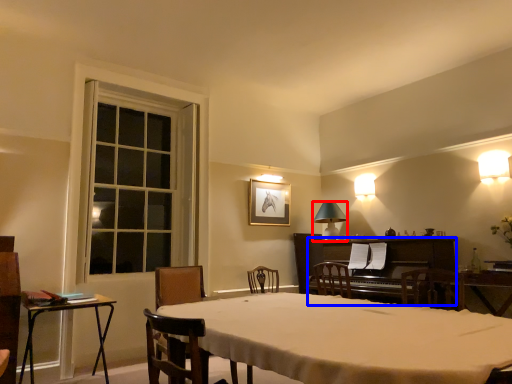
Question: Which object appears closest to the camera in this image, lamp (highlighted by a red box) or piano (highlighted by a blue box)?

Choices:
 (A) lamp
 (B) piano

Answer: (B)